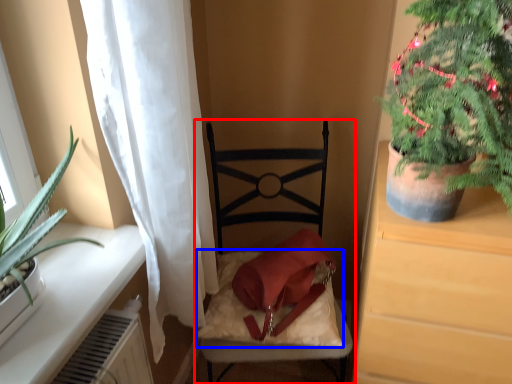
Question: Which object is closer to the camera taking this photo, chair (highlighted by a red box) or pillow (highlighted by a blue box)?

Choices:
 (A) chair
 (B) pillow

Answer: (A)